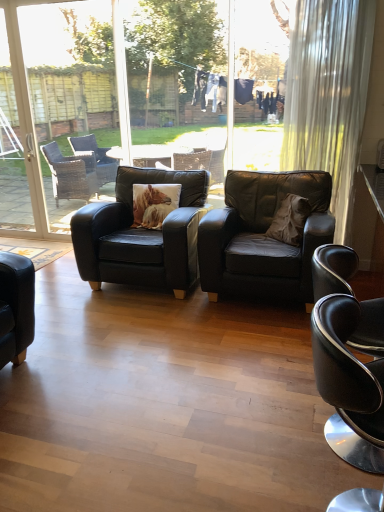
Question: Which direction should I rotate to look at matte black armchair at center, the second chair viewed from the front?

Choices:
 (A) right
 (B) left

Answer: (A)

Question: From a real-world perspective, is brown suede pillow at center, the 1th pillow positioned from the right, located beneath black leather chair at lower right, which is counted as the 3th chair, starting from the back?

Choices:
 (A) yes
 (B) no

Answer: (B)

Question: Considering the relative sizes of brown suede pillow at center, which ranks as the second pillow in left-to-right order, and black leather chair at lower right, the 1th chair from the front, in the image provided, is brown suede pillow at center, which ranks as the second pillow in left-to-right order, wider than black leather chair at lower right, the 1th chair from the front,?

Choices:
 (A) no
 (B) yes

Answer: (A)

Question: Can you confirm if brown suede pillow at center, the 1th pillow positioned from the right, is smaller than black leather chair at lower right, the 1th chair from the front?

Choices:
 (A) yes
 (B) no

Answer: (A)

Question: From the image's perspective, is brown suede pillow at center, which ranks as the second pillow in left-to-right order, located beneath black leather chair at lower right, the 1th chair from the front?

Choices:
 (A) no
 (B) yes

Answer: (A)

Question: From a real-world perspective, is brown suede pillow at center, which ranks as the second pillow in left-to-right order, positioned over black leather chair at lower right, the 1th chair from the front, based on gravity?

Choices:
 (A) yes
 (B) no

Answer: (A)

Question: Is black leather chair at lower right, which is counted as the 3th chair, starting from the back, turned away from white glass screen door at left, which appears as the 2th screen door when viewed from the right?

Choices:
 (A) no
 (B) yes

Answer: (A)

Question: Does black leather chair at lower right, which is counted as the 3th chair, starting from the back, have a greater width compared to white glass screen door at left, the 1th screen door viewed from the left?

Choices:
 (A) yes
 (B) no

Answer: (A)

Question: From a real-world perspective, does black leather chair at lower right, which is counted as the 3th chair, starting from the back, stand above white glass screen door at left, the 1th screen door viewed from the left?

Choices:
 (A) no
 (B) yes

Answer: (A)

Question: Is the depth of black leather chair at lower right, the 1th chair from the front, greater than that of white glass screen door at left, which appears as the 2th screen door when viewed from the right?

Choices:
 (A) yes
 (B) no

Answer: (B)

Question: Is black leather chair at lower right, which is counted as the 3th chair, starting from the back, at the right side of white glass screen door at left, which appears as the 2th screen door when viewed from the right?

Choices:
 (A) no
 (B) yes

Answer: (B)

Question: Are black leather chair at lower right, which is counted as the 3th chair, starting from the back, and white glass screen door at left, the 1th screen door viewed from the left, located far from each other?

Choices:
 (A) no
 (B) yes

Answer: (B)

Question: From a real-world perspective, is matte black armchair at center, the second chair viewed from the front, over white glass screen door at left, the 1th screen door viewed from the left?

Choices:
 (A) no
 (B) yes

Answer: (A)